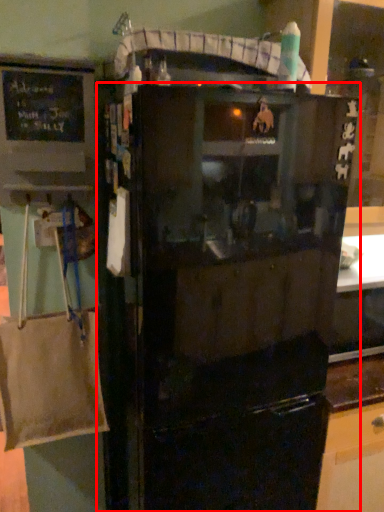
Question: From the image, what is the correct spatial relationship of refrigerator (annotated by the red box) in relation to bulletin board?

Choices:
 (A) right
 (B) left

Answer: (A)